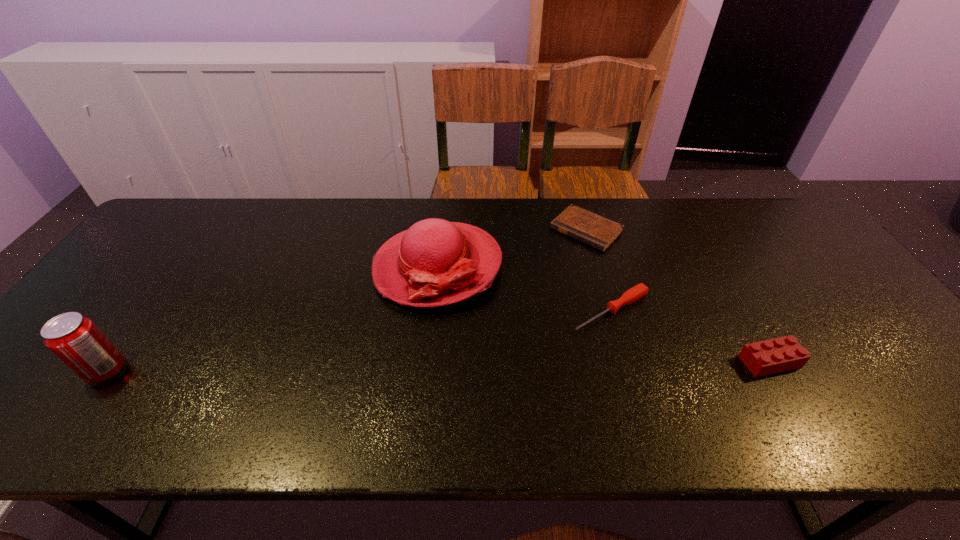
The height and width of the screenshot is (540, 960). Find the location of `the leftmost object`. the leftmost object is located at coordinates (75, 339).

Identify the location of the rightmost object. Image resolution: width=960 pixels, height=540 pixels. (762, 358).

I want to click on Lego, so click(762, 358).

You are a GUI agent. You are given a task and a screenshot of the screen. Output one action in this format:
    pyautogui.click(x=<x>, y=<y>)
    Task: Click on the diary
    The width and height of the screenshot is (960, 540).
    Given the screenshot: What is the action you would take?
    pyautogui.click(x=599, y=232)

Locate an element on the screen. This screenshot has width=960, height=540. hat is located at coordinates (435, 262).

Where is `screwdriver`? This screenshot has height=540, width=960. screwdriver is located at coordinates (635, 293).

The image size is (960, 540). Identify the location of vacant region located 0.060m on the right of the leftmost object. (151, 370).

The image size is (960, 540). What are the coordinates of `free space located 0.080m on the left of the Lego` in the screenshot? It's located at (707, 361).

This screenshot has height=540, width=960. In order to click on free region located on the spine side of the shortest object in this screenshot , I will do `click(546, 268)`.

At what (x,y) coordinates should I click in order to perform the action: click on free space located on the spine side of the shortest object. Please return your answer as a coordinate pair (x, y). Image resolution: width=960 pixels, height=540 pixels. Looking at the image, I should click on (520, 294).